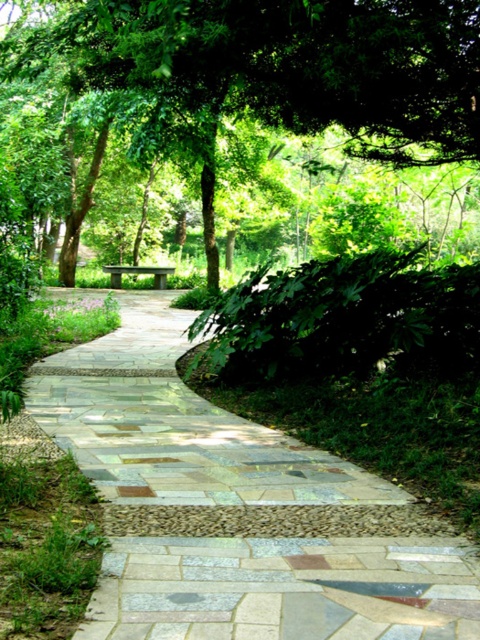
Can you confirm if green leafy tree at center is positioned below green stone bench at center?

Actually, green leafy tree at center is above green stone bench at center.

Is point (176, 42) positioned behind point (128, 268)?

No, it is in front of (128, 268).

Locate an element on the screen. The image size is (480, 640). green leafy tree at center is located at coordinates (285, 65).

Find the location of a particular element. The width and height of the screenshot is (480, 640). natural stone pathway at center is located at coordinates (232, 508).

This screenshot has height=640, width=480. I want to click on natural stone pathway at center, so click(232, 508).

Find the location of a particular element. natural stone pathway at center is located at coordinates (232, 508).

Is natural stone pathway at center thinner than green stone bench at center?

In fact, natural stone pathway at center might be wider than green stone bench at center.

Is natural stone pathway at center smaller than green stone bench at center?

Incorrect, natural stone pathway at center is not smaller in size than green stone bench at center.

Find the location of a particular element. Image resolution: width=480 pixels, height=640 pixels. natural stone pathway at center is located at coordinates (232, 508).